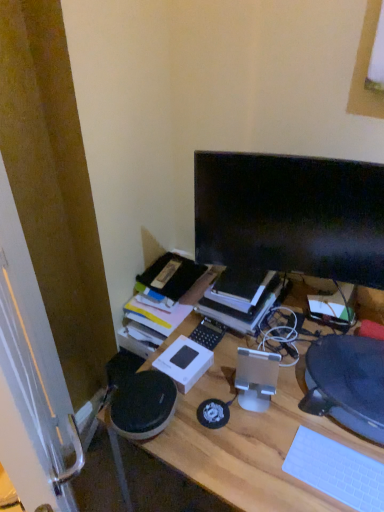
You are a GUI agent. You are given a task and a screenshot of the screen. Output one action in this format:
    pyautogui.click(x=<x>, y=<y>)
    Task: Click on the free space above black textured computer chair at right (from a real-world perspective)
    The image size is (384, 512).
    Given the screenshot: What is the action you would take?
    pyautogui.click(x=349, y=367)